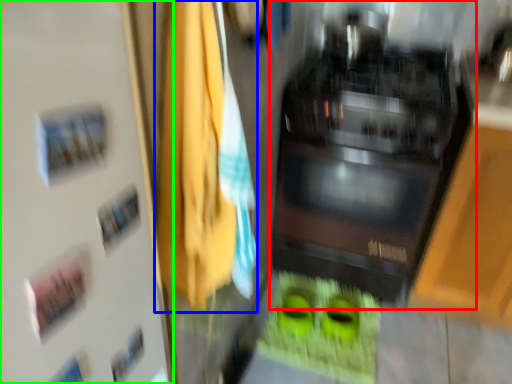
Question: Which object is the closest to the home appliance (highlighted by a red box)? Choose among these: laundry (highlighted by a blue box) or door (highlighted by a green box).

Choices:
 (A) laundry
 (B) door

Answer: (A)